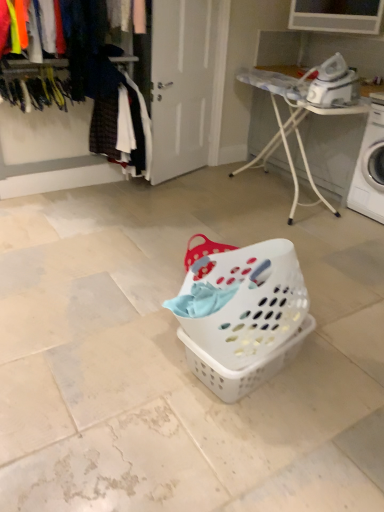
Image resolution: width=384 pixels, height=512 pixels. What are the coordinates of `plaid fabric shirt at left` in the screenshot? It's located at (121, 120).

Identify the location of white plastic washing machine at right. This screenshot has height=512, width=384. (370, 166).

Locate an element on the screen. Image resolution: width=384 pixels, height=512 pixels. matte plastic clothes at upper left is located at coordinates (x=49, y=151).

Locate an element on the screen. The width and height of the screenshot is (384, 512). white plastic ironing board at upper right is located at coordinates (302, 113).

Is velvet-like fabric at upper left with white plastic washing machine at right?

No, velvet-like fabric at upper left is not making contact with white plastic washing machine at right.

Considering the sizes of velvet-like fabric at upper left and white plastic washing machine at right in the image, is velvet-like fabric at upper left bigger or smaller than white plastic washing machine at right?

Considering their sizes, velvet-like fabric at upper left takes up less space than white plastic washing machine at right.

Considering the positions of points (19, 97) and (381, 121), is point (19, 97) closer to camera compared to point (381, 121)?

That is True.

From a real-world perspective, does velvet-like fabric at upper left stand above white plastic washing machine at right?

Yes, from a real-world perspective, velvet-like fabric at upper left is over white plastic washing machine at right

Find the location of a particular element. appliance located in front of the white plastic ironing board at upper right is located at coordinates (333, 84).

Who is smaller, white plastic iron at upper right or white plastic ironing board at upper right?

white plastic iron at upper right is smaller.

Which of these two, white plastic iron at upper right or white plastic ironing board at upper right, stands shorter?

Standing shorter between the two is white plastic iron at upper right.

What's the angular difference between white plastic iron at upper right and white plastic ironing board at upper right's facing directions?

The facing directions of white plastic iron at upper right and white plastic ironing board at upper right are 5.69 degrees apart.

Considering the relative sizes of plaid fabric shirt at left and white plastic washing machine at right in the image provided, is plaid fabric shirt at left thinner than white plastic washing machine at right?

Yes.

Consider the image. Can you confirm if plaid fabric shirt at left is shorter than white plastic washing machine at right?

No, plaid fabric shirt at left is not shorter than white plastic washing machine at right.

Is plaid fabric shirt at left oriented away from white plastic washing machine at right?

No, plaid fabric shirt at left is not facing away from white plastic washing machine at right.

Is plaid fabric shirt at left not close to white plastic washing machine at right?

That's right, there is a large distance between plaid fabric shirt at left and white plastic washing machine at right.

From the picture: Does white plastic iron at upper right touch matte plastic clothes at upper left?

No, white plastic iron at upper right is not making contact with matte plastic clothes at upper left.

Considering the sizes of objects white plastic iron at upper right and matte plastic clothes at upper left in the image provided, who is bigger, white plastic iron at upper right or matte plastic clothes at upper left?

matte plastic clothes at upper left.

Measure the distance from white plastic iron at upper right to matte plastic clothes at upper left.

white plastic iron at upper right is 1.99 meters from matte plastic clothes at upper left.

Between point (333, 93) and point (44, 118), which one is positioned in front?

The point (333, 93) is more forward.

Is white plastic ironing board at upper right touching white plastic laundry basket at center?

white plastic ironing board at upper right and white plastic laundry basket at center are clearly separated.

Is white plastic ironing board at upper right at the right side of white plastic laundry basket at center?

Yes.

Who is more distant, white plastic ironing board at upper right or white plastic laundry basket at center?

white plastic ironing board at upper right is further away from the camera.

From a real-world perspective, who is located lower, white plastic ironing board at upper right or white plastic laundry basket at center?

white plastic laundry basket at center, from a real-world perspective.

Is point (191, 329) less distant than point (61, 101)?

Yes.

Is white plastic laundry basket at center facing towards velvet-like fabric at upper left?

No.

Measure the distance between white plastic laundry basket at center and velvet-like fabric at upper left.

They are 6.66 feet apart.

Considering the sizes of objects white plastic laundry basket at center and velvet-like fabric at upper left in the image provided, who is thinner, white plastic laundry basket at center or velvet-like fabric at upper left?

With smaller width is velvet-like fabric at upper left.

Is velvet-like fabric at upper left at the right side of white plastic ironing board at upper right?

No.

Is velvet-like fabric at upper left inside or outside of white plastic ironing board at upper right?

velvet-like fabric at upper left exists outside the volume of white plastic ironing board at upper right.

Does velvet-like fabric at upper left have a smaller size compared to white plastic ironing board at upper right?

Yes.

Is velvet-like fabric at upper left shorter than white plastic ironing board at upper right?

Correct, velvet-like fabric at upper left is not as tall as white plastic ironing board at upper right.

Find the location of a particular element. The height and width of the screenshot is (512, 384). washing machine below the velvet-like fabric at upper left (from a real-world perspective) is located at coordinates (370, 166).

Find the location of a particular element. This screenshot has width=384, height=512. furniture behind the white plastic iron at upper right is located at coordinates (302, 113).

Estimate the real-world distances between objects in this image. Which object is closer to white plastic ironing board at upper right, plaid fabric shirt at left or velvet-like fabric at upper left?

plaid fabric shirt at left lies closer to white plastic ironing board at upper right than the other object.

Estimate the real-world distances between objects in this image. Which object is closer to velvet-like fabric at upper left, white plastic laundry basket at center or matte plastic clothes at upper left?

matte plastic clothes at upper left.

Looking at the image, which one is located further to velvet-like fabric at upper left, plaid fabric shirt at left or white plastic laundry basket at center?

A: Based on the image, white plastic laundry basket at center appears to be further to velvet-like fabric at upper left.

When comparing their distances from matte plastic clothes at upper left, does plaid fabric shirt at left or white plastic laundry basket at center seem closer?

Based on the image, plaid fabric shirt at left appears to be nearer to matte plastic clothes at upper left.

From the image, which object appears to be nearer to plaid fabric shirt at left, white plastic iron at upper right or white plastic laundry basket at center?

Among the two, white plastic iron at upper right is located nearer to plaid fabric shirt at left.

Estimate the real-world distances between objects in this image. Which object is closer to white plastic washing machine at right, matte plastic clothes at upper left or velvet-like fabric at upper left?

Based on the image, matte plastic clothes at upper left appears to be nearer to white plastic washing machine at right.

Estimate the real-world distances between objects in this image. Which object is closer to white plastic laundry basket at center, matte plastic clothes at upper left or white plastic washing machine at right?

white plastic washing machine at right lies closer to white plastic laundry basket at center than the other object.

Consider the image. Estimate the real-world distances between objects in this image. Which object is closer to matte plastic clothes at upper left, white plastic iron at upper right or plaid fabric shirt at left?

plaid fabric shirt at left is closer to matte plastic clothes at upper left.

You are a GUI agent. You are given a task and a screenshot of the screen. Output one action in this format:
    pyautogui.click(x=<x>, y=<y>)
    Task: Click on the shopping basket situated between matte plastic clothes at upper left and white plastic iron at upper right from left to right
    The image size is (384, 512).
    Given the screenshot: What is the action you would take?
    pyautogui.click(x=242, y=316)

Where is `shopping basket between matte plastic clothes at upper left and white plastic washing machine at right in the horizontal direction`? shopping basket between matte plastic clothes at upper left and white plastic washing machine at right in the horizontal direction is located at coordinates (242, 316).

At what (x,y) coordinates should I click in order to perform the action: click on shopping basket between velvet-like fabric at upper left and white plastic washing machine at right from left to right. Please return your answer as a coordinate pair (x, y). This screenshot has height=512, width=384. Looking at the image, I should click on (242, 316).

Identify the location of clothing situated between matte plastic clothes at upper left and white plastic ironing board at upper right from left to right. This screenshot has height=512, width=384. 121,120.